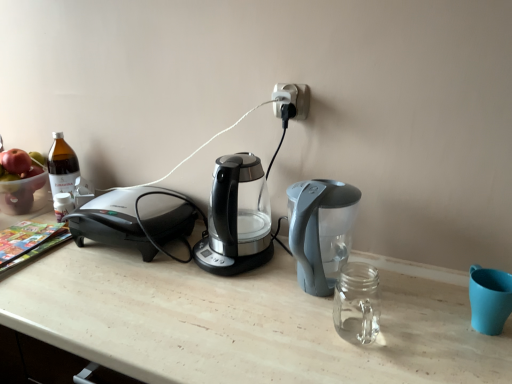
Question: Is point (300, 102) closer or farther from the camera than point (236, 177)?

Choices:
 (A) farther
 (B) closer

Answer: (A)

Question: Relative to transparent glass coffee maker at center, is black plastic plug at upper center in front or behind?

Choices:
 (A) front
 (B) behind

Answer: (B)

Question: Estimate the real-world distances between objects in this image. Which object is farther from the transparent glass coffee maker at center?

Choices:
 (A) translucent plastic bowl at left
 (B) black plastic plug at upper center

Answer: (A)

Question: Which object is the closest to the black plastic plug at upper center?

Choices:
 (A) transparent glass coffee maker at center
 (B) translucent plastic bowl at left

Answer: (A)